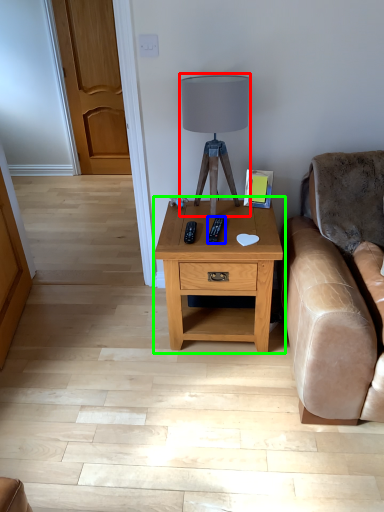
Question: Which object is positioned closest to table lamp (highlighted by a red box)? Select from remote (highlighted by a blue box) and nightstand (highlighted by a green box).

Choices:
 (A) remote
 (B) nightstand

Answer: (A)